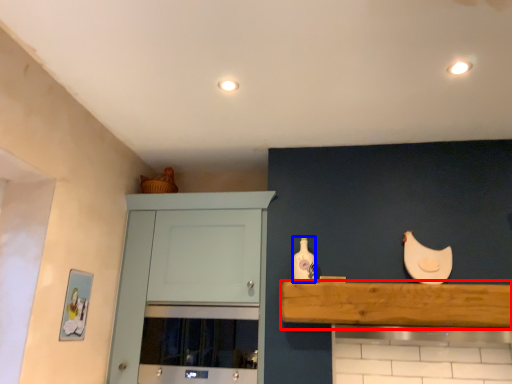
Question: Which of the following is the farthest to the observer, shelf (highlighted by a red box) or bottle (highlighted by a blue box)?

Choices:
 (A) shelf
 (B) bottle

Answer: (B)